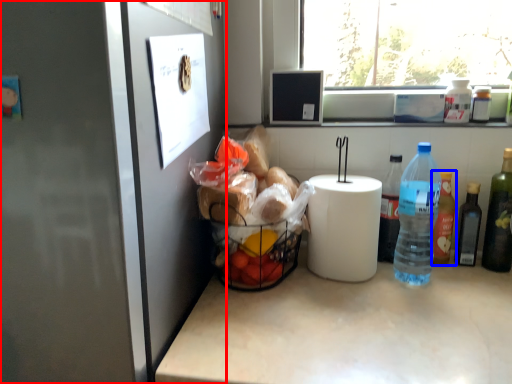
Question: Among these objects, which one is farthest to the camera, fridge (highlighted by a red box) or bottle (highlighted by a blue box)?

Choices:
 (A) fridge
 (B) bottle

Answer: (B)